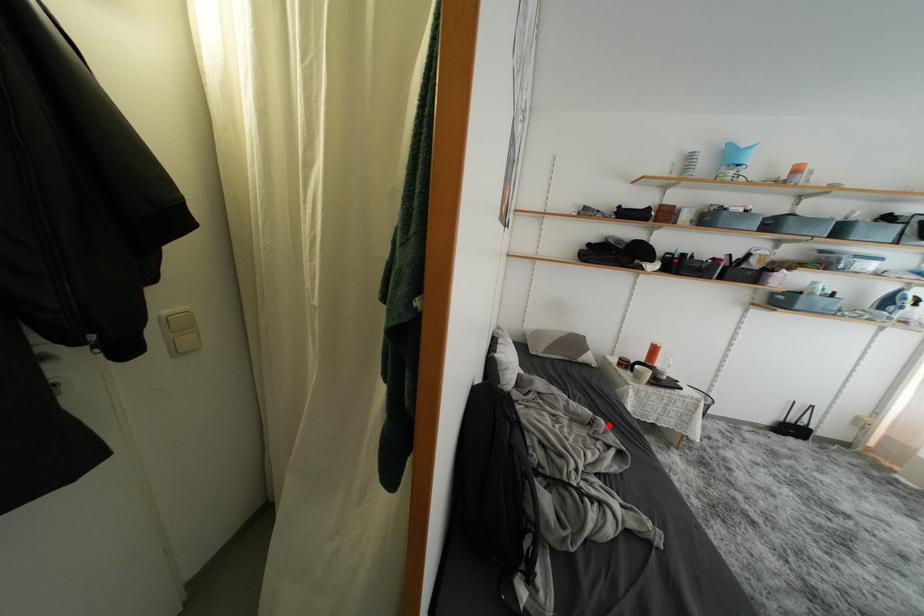
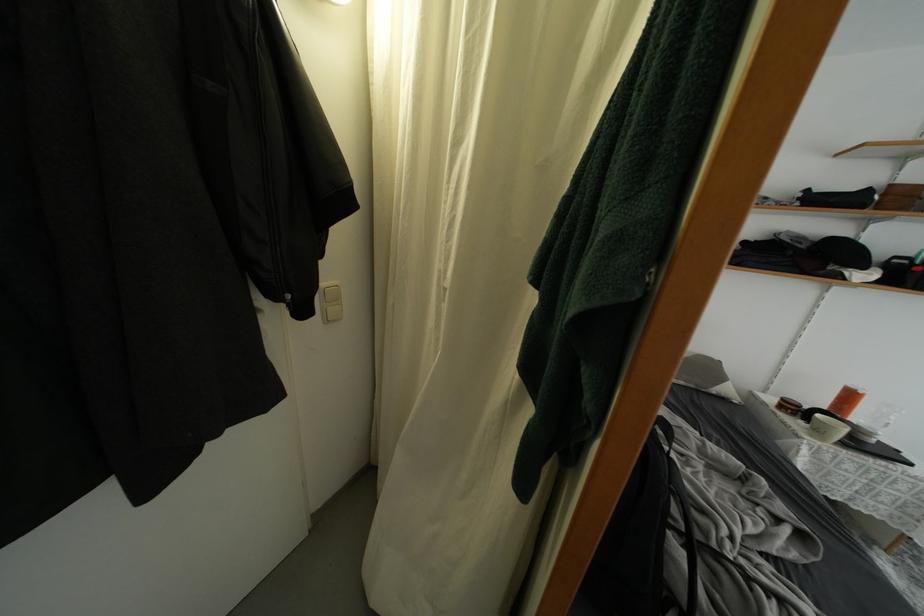
The point at the highlighted location is marked in the first image. Where is the corresponding point in the second image?

(769, 485)